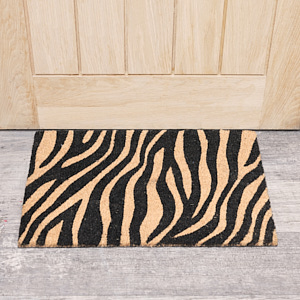
This screenshot has height=300, width=300. I want to click on floor, so click(151, 273).